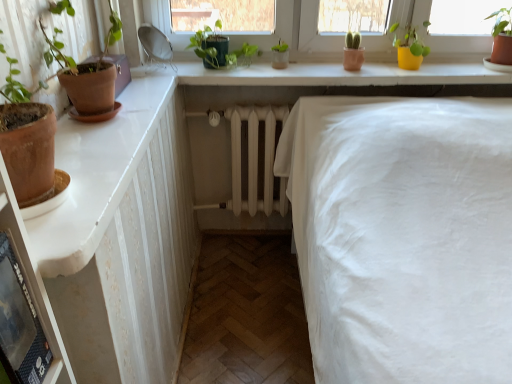
Question: Are black plastic shelf at lower left and terracotta clay pot at left located far from each other?

Choices:
 (A) yes
 (B) no

Answer: (B)

Question: Can you confirm if black plastic shelf at lower left is taller than terracotta clay pot at left?

Choices:
 (A) no
 (B) yes

Answer: (B)

Question: Is black plastic shelf at lower left closer to the viewer compared to terracotta clay pot at left?

Choices:
 (A) yes
 (B) no

Answer: (A)

Question: Considering the relative sizes of black plastic shelf at lower left and terracotta clay pot at left in the image provided, is black plastic shelf at lower left wider than terracotta clay pot at left?

Choices:
 (A) yes
 (B) no

Answer: (B)

Question: Is black plastic shelf at lower left thinner than terracotta clay pot at left?

Choices:
 (A) yes
 (B) no

Answer: (A)

Question: In terms of height, does yellow matte pot at upper right, placed as the first houseplant when sorted from right to left, look taller or shorter compared to green matte plant at upper center, acting as the 1th houseplant starting from the left?

Choices:
 (A) tall
 (B) short

Answer: (A)

Question: From a real-world perspective, relative to green matte plant at upper center, acting as the 1th houseplant starting from the left, is yellow matte pot at upper right, positioned as the 2th houseplant in left-to-right order, vertically above or below?

Choices:
 (A) above
 (B) below

Answer: (B)

Question: Considering the positions of point (402, 64) and point (245, 59), is point (402, 64) closer or farther from the camera than point (245, 59)?

Choices:
 (A) farther
 (B) closer

Answer: (B)

Question: Considering the relative positions of yellow matte pot at upper right, positioned as the 2th houseplant in left-to-right order, and green matte plant at upper center, which is the 2th houseplant from right to left, in the image provided, is yellow matte pot at upper right, positioned as the 2th houseplant in left-to-right order, to the left or to the right of green matte plant at upper center, which is the 2th houseplant from right to left,?

Choices:
 (A) right
 (B) left

Answer: (A)

Question: Based on their sizes in the image, would you say black plastic shelf at lower left is bigger or smaller than white glossy dresser at left?

Choices:
 (A) big
 (B) small

Answer: (B)

Question: Visually, is black plastic shelf at lower left positioned to the left or to the right of white glossy dresser at left?

Choices:
 (A) right
 (B) left

Answer: (B)

Question: From a real-world perspective, is black plastic shelf at lower left positioned above or below white glossy dresser at left?

Choices:
 (A) above
 (B) below

Answer: (B)

Question: Considering their positions, is black plastic shelf at lower left located in front of or behind white glossy dresser at left?

Choices:
 (A) behind
 (B) front

Answer: (B)

Question: In terms of height, does black plastic shelf at lower left look taller or shorter compared to yellow matte pot at upper right, placed as the first houseplant when sorted from right to left?

Choices:
 (A) short
 (B) tall

Answer: (B)

Question: Is black plastic shelf at lower left situated inside yellow matte pot at upper right, positioned as the 2th houseplant in left-to-right order, or outside?

Choices:
 (A) outside
 (B) inside

Answer: (A)